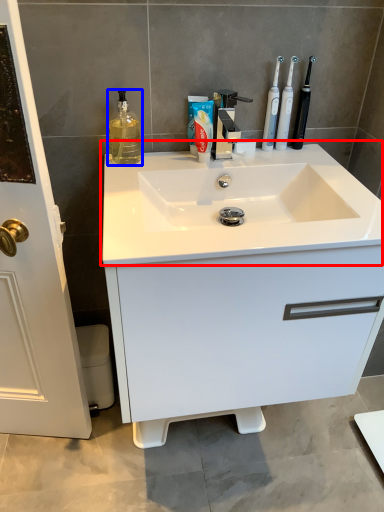
Question: Which point is further to the camera, sink (highlighted by a red box) or cleaning product (highlighted by a blue box)?

Choices:
 (A) sink
 (B) cleaning product

Answer: (B)